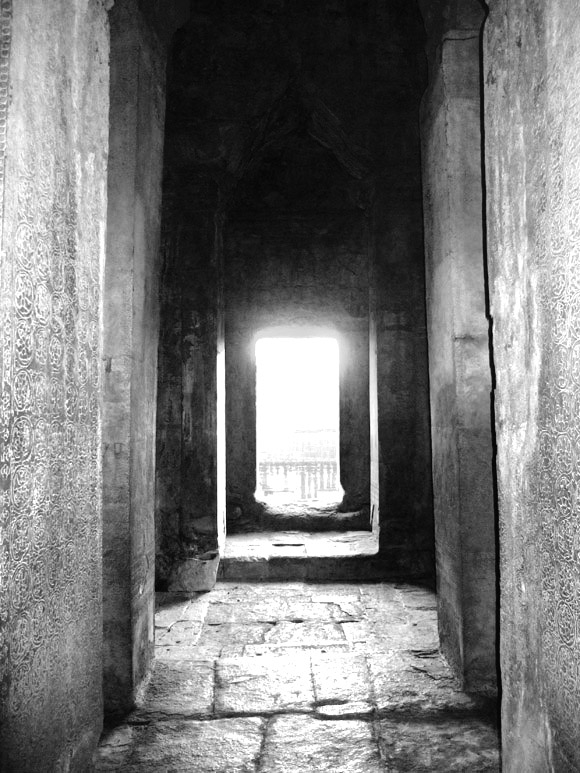
The image size is (580, 773). Identify the location of wall. (37, 458), (119, 434), (172, 419), (430, 423), (522, 448).